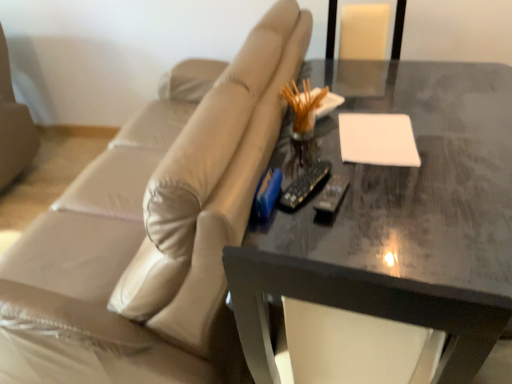
Find the location of a particular element. The width and height of the screenshot is (512, 384). free space behind white matte notepad at upper right is located at coordinates pos(375,105).